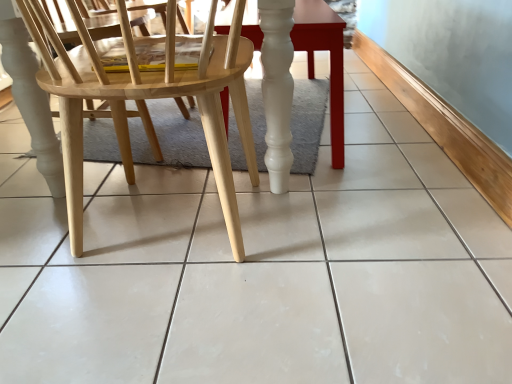
The height and width of the screenshot is (384, 512). What are the coordinates of `smooth glossy wood table at center` in the screenshot? It's located at (330, 60).

Describe the element at coordinates (330, 60) in the screenshot. This screenshot has width=512, height=384. I see `smooth glossy wood table at center` at that location.

Find the location of a particular element. natural wood chair at left is located at coordinates (147, 98).

What do you see at coordinates (147, 98) in the screenshot? This screenshot has height=384, width=512. I see `natural wood chair at left` at bounding box center [147, 98].

The height and width of the screenshot is (384, 512). In order to click on smooth glossy wood table at center in this screenshot , I will do `click(330, 60)`.

Is smooth glossy wood table at center at the left side of natural wood chair at left?

In fact, smooth glossy wood table at center is to the right of natural wood chair at left.

Which object is further away from the camera taking this photo, smooth glossy wood table at center or natural wood chair at left?

smooth glossy wood table at center is further away from the camera.

Which is behind, point (257, 30) or point (74, 117)?

Positioned behind is point (257, 30).

From the image's perspective, is smooth glossy wood table at center located beneath natural wood chair at left?

No, from the image's perspective, smooth glossy wood table at center is not beneath natural wood chair at left.

From a real-world perspective, is smooth glossy wood table at center physically below natural wood chair at left?

Correct, in the physical world, smooth glossy wood table at center is lower than natural wood chair at left.

Can you confirm if smooth glossy wood table at center is wider than natural wood chair at left?

No.

In terms of height, does smooth glossy wood table at center look taller or shorter compared to natural wood chair at left?

In the image, smooth glossy wood table at center appears to be shorter than natural wood chair at left.

Which of these two, smooth glossy wood table at center or natural wood chair at left, is smaller?

natural wood chair at left.

Choose the correct answer: Is smooth glossy wood table at center inside natural wood chair at left or outside it?

smooth glossy wood table at center exists outside the volume of natural wood chair at left.

Is smooth glossy wood table at center with natural wood chair at left?

No, smooth glossy wood table at center is not beside natural wood chair at left.

Is smooth glossy wood table at center aimed at natural wood chair at left?

No, smooth glossy wood table at center is not aimed at natural wood chair at left.

Can you tell me how much smooth glossy wood table at center and natural wood chair at left differ in facing direction?

There is a 90.2-degree angle between the facing directions of smooth glossy wood table at center and natural wood chair at left.

How far apart are smooth glossy wood table at center and natural wood chair at left?

smooth glossy wood table at center and natural wood chair at left are 28.21 centimeters apart from each other.

Find the location of a particular element. This screenshot has height=384, width=512. table behind the natural wood chair at left is located at coordinates (330, 60).

Considering the relative positions of natural wood chair at left and smooth glossy wood table at center in the image provided, is natural wood chair at left to the left of smooth glossy wood table at center from the viewer's perspective?

Answer: Correct, you'll find natural wood chair at left to the left of smooth glossy wood table at center.

Between natural wood chair at left and smooth glossy wood table at center, which one is positioned in front?

Positioned in front is natural wood chair at left.

Is point (85, 81) positioned in front of point (335, 17)?

Yes.

From the image's perspective, is natural wood chair at left above or below smooth glossy wood table at center?

natural wood chair at left is situated lower than smooth glossy wood table at center in the image.

From a real-world perspective, is natural wood chair at left positioned above or below smooth glossy wood table at center?

Clearly, from a real-world perspective, natural wood chair at left is above smooth glossy wood table at center.

Which of these two, natural wood chair at left or smooth glossy wood table at center, is thinner?

smooth glossy wood table at center is thinner.

Which of these two, natural wood chair at left or smooth glossy wood table at center, stands shorter?

With less height is smooth glossy wood table at center.

Which of these two, natural wood chair at left or smooth glossy wood table at center, is bigger?

With larger size is smooth glossy wood table at center.

Is natural wood chair at left positioned beyond the bounds of smooth glossy wood table at center?

natural wood chair at left lies outside smooth glossy wood table at center's area.

Are natural wood chair at left and smooth glossy wood table at center beside each other?

No, natural wood chair at left is not making contact with smooth glossy wood table at center.

Is natural wood chair at left facing away from smooth glossy wood table at center?

Yes.

Can you tell me how much natural wood chair at left and smooth glossy wood table at center differ in facing direction?

There is a 90.2-degree angle between the facing directions of natural wood chair at left and smooth glossy wood table at center.

Locate an element on the screen. The width and height of the screenshot is (512, 384). table below the natural wood chair at left (from a real-world perspective) is located at coordinates pos(330,60).

The image size is (512, 384). What are the coordinates of `chair in front of the smooth glossy wood table at center` in the screenshot? It's located at (147, 98).

At what (x,y) coordinates should I click in order to perform the action: click on table lying on the right of natural wood chair at left. Please return your answer as a coordinate pair (x, y). The width and height of the screenshot is (512, 384). Looking at the image, I should click on (330, 60).